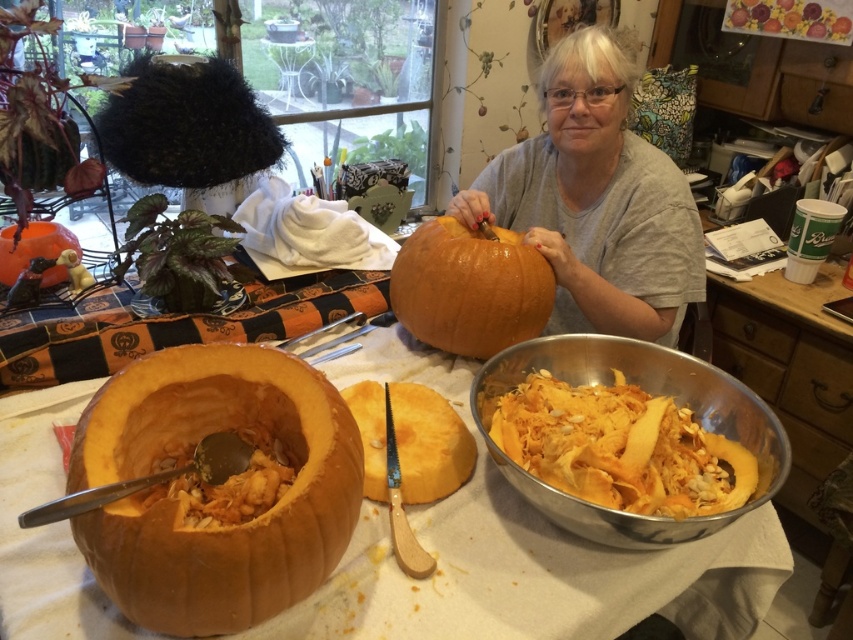
You are standing in front of the carving table. There is a point marked at coordinates (610, 291) on the table. If you want to place a small knife exactly at that point, will you be able to do so without moving any other items on the table?

The point at coordinates (610, 291) is 4.23 feet away from the viewer. Since the knife is already placed beside the partially carved pumpkin, you would need to check if there is space at that specific coordinate. However, the description does not mention any obstruction at that point, so it might be possible to place the knife there without moving other items.

You are a photographer setting up a shot of the scene. You need to ensure that the gray matte shirt at upper center and the glossy orange pumpkin at center are both in focus. Since you know the shirt is above the pumpkin, where should you focus your camera to capture both objects clearly?

Since the gray matte shirt at upper center is located above the glossy orange pumpkin at center, you should focus your camera at the midpoint between them to ensure both are in focus.